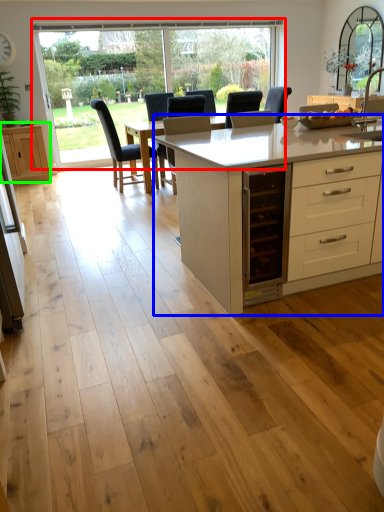
Question: Considering the real-world distances, which object is farthest from window (highlighted by a red box)? table (highlighted by a blue box) or cabinetry (highlighted by a green box)?

Choices:
 (A) table
 (B) cabinetry

Answer: (A)